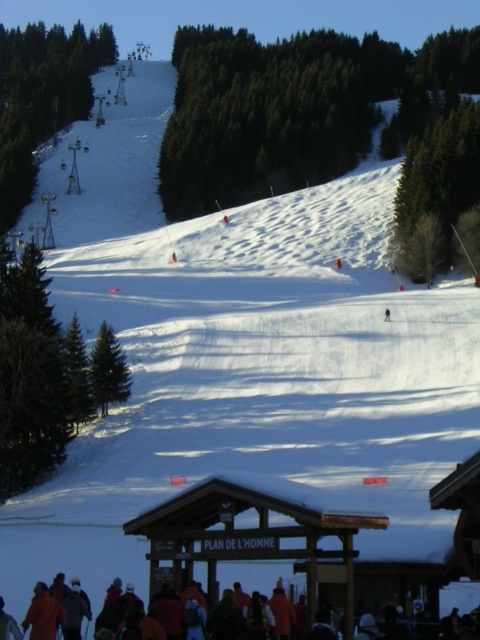
The height and width of the screenshot is (640, 480). What do you see at coordinates (458, 596) in the screenshot?
I see `orange fabric jacket at lower center` at bounding box center [458, 596].

Does orange fabric jacket at lower center have a lesser height compared to dark blue jacket at lower left?

No, orange fabric jacket at lower center is not shorter than dark blue jacket at lower left.

Locate an element on the screen. The image size is (480, 640). orange fabric jacket at lower center is located at coordinates (458, 596).

Can you confirm if orange ski jacket at lower left is smaller than dark blue jacket at lower left?

Yes.

Who is higher up, orange ski jacket at lower left or dark blue jacket at lower left?

orange ski jacket at lower left is above.

Is point (60, 605) less distant than point (0, 608)?

That is False.

Locate an element on the screen. The height and width of the screenshot is (640, 480). orange ski jacket at lower left is located at coordinates (43, 612).

Between orange fabric jacket at lower center and orange ski jacket at lower left, which one is positioned higher?

orange ski jacket at lower left is above.

Is point (99, 589) farther from viewer compared to point (49, 627)?

Yes, it is behind point (49, 627).

Identify the location of orange fabric jacket at lower center. (458, 596).